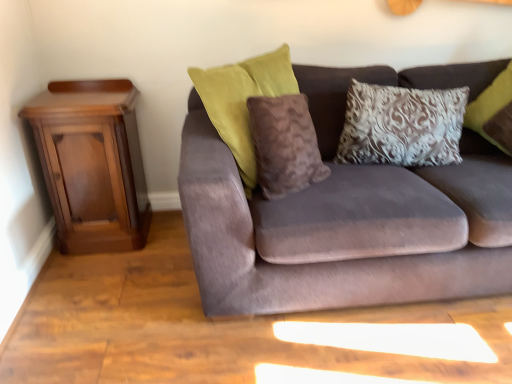
Question: Is velvet brown couch at center positioned behind mahogany wood nightstand at left?

Choices:
 (A) yes
 (B) no

Answer: (B)

Question: Considering the relative sizes of velvet brown couch at center and mahogany wood nightstand at left in the image provided, is velvet brown couch at center shorter than mahogany wood nightstand at left?

Choices:
 (A) no
 (B) yes

Answer: (A)

Question: Is velvet brown couch at center facing towards mahogany wood nightstand at left?

Choices:
 (A) no
 (B) yes

Answer: (A)

Question: Is velvet brown couch at center looking in the opposite direction of mahogany wood nightstand at left?

Choices:
 (A) yes
 (B) no

Answer: (B)

Question: Is velvet brown couch at center thinner than mahogany wood nightstand at left?

Choices:
 (A) no
 (B) yes

Answer: (A)

Question: From a real-world perspective, is silver textured pillow at upper right, the 2th pillow from the left, physically located above or below mahogany wood nightstand at left?

Choices:
 (A) below
 (B) above

Answer: (B)

Question: Which is correct: silver textured pillow at upper right, the 2th pillow from the left, is inside mahogany wood nightstand at left, or outside of it?

Choices:
 (A) inside
 (B) outside

Answer: (B)

Question: Is point (386, 115) closer or farther from the camera than point (75, 187)?

Choices:
 (A) closer
 (B) farther

Answer: (A)

Question: From the image's perspective, is silver textured pillow at upper right, which is the first pillow from right to left, above or below mahogany wood nightstand at left?

Choices:
 (A) below
 (B) above

Answer: (B)

Question: Is mahogany wood nightstand at left wider or thinner than velvet brown couch at center?

Choices:
 (A) wide
 (B) thin

Answer: (B)

Question: Considering their positions, is mahogany wood nightstand at left located in front of or behind velvet brown couch at center?

Choices:
 (A) behind
 (B) front

Answer: (A)

Question: Is mahogany wood nightstand at left inside the boundaries of velvet brown couch at center, or outside?

Choices:
 (A) outside
 (B) inside

Answer: (A)

Question: Considering the positions of mahogany wood nightstand at left and velvet brown couch at center in the image, is mahogany wood nightstand at left bigger or smaller than velvet brown couch at center?

Choices:
 (A) big
 (B) small

Answer: (B)

Question: Is brown fuzzy pillow at center, which is counted as the 2th pillow, starting from the right, to the left or to the right of silver textured pillow at upper right, the 2th pillow from the left, in the image?

Choices:
 (A) right
 (B) left

Answer: (B)

Question: In terms of size, does brown fuzzy pillow at center, which is counted as the 2th pillow, starting from the right, appear bigger or smaller than silver textured pillow at upper right, the 2th pillow from the left?

Choices:
 (A) big
 (B) small

Answer: (B)